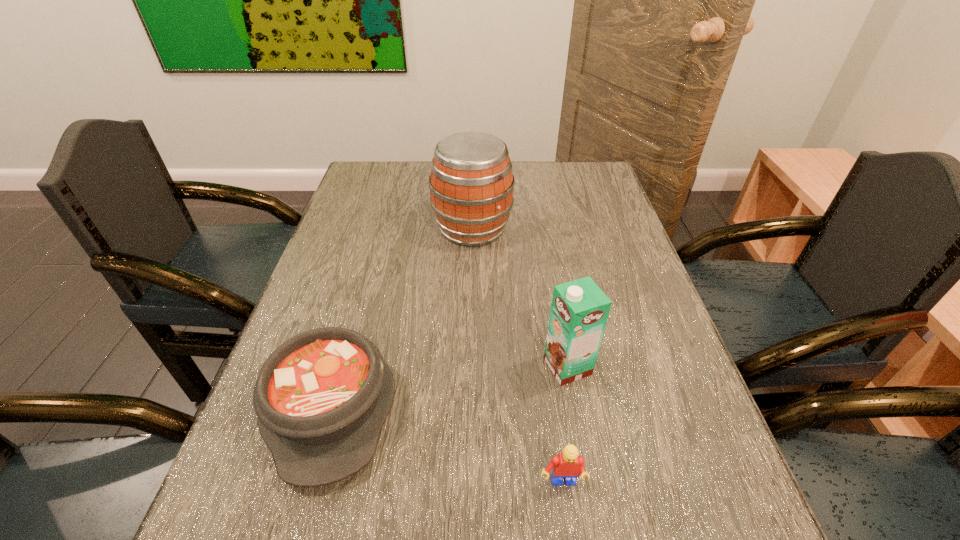
Find the location of a particular element. the farthest object is located at coordinates (x=471, y=184).

I want to click on cider, so click(x=471, y=184).

Where is `carton`? The image size is (960, 540). carton is located at coordinates (579, 311).

Find the location of `casserole`. casserole is located at coordinates (322, 397).

Where is `Lego`? The width and height of the screenshot is (960, 540). Lego is located at coordinates (567, 464).

The height and width of the screenshot is (540, 960). I want to click on vacant area situated 0.050m on the right of the second object from left to right, so click(x=529, y=228).

Locate an element on the screen. The height and width of the screenshot is (540, 960). free space located on the right of the carton is located at coordinates pos(653,367).

Where is `free region located on the back of the casserole`? The width and height of the screenshot is (960, 540). free region located on the back of the casserole is located at coordinates (376, 246).

This screenshot has width=960, height=540. I want to click on object located in the left edge section of the desktop, so click(x=322, y=397).

The width and height of the screenshot is (960, 540). Identify the location of free location at the far edge. (537, 167).